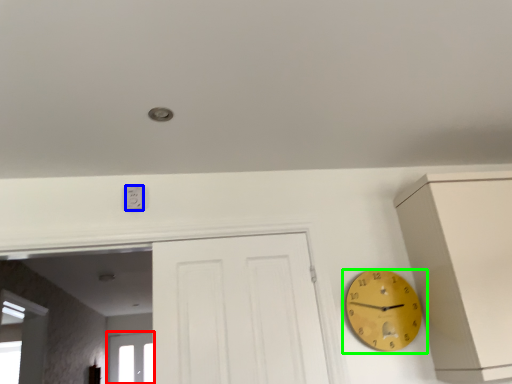
Question: Which object is positioned farthest from window (highlighted by a red box)? Select from electric outlet (highlighted by a blue box) and wall clock (highlighted by a green box).

Choices:
 (A) electric outlet
 (B) wall clock

Answer: (B)